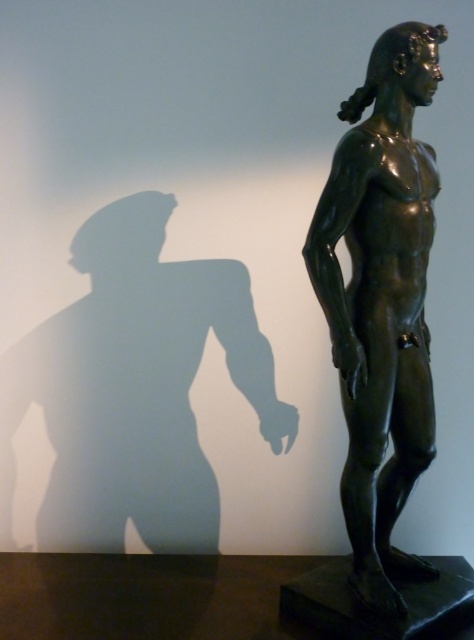
Question: Can you confirm if bronze statue at upper center is bigger than shiny bronze statue at center?

Choices:
 (A) yes
 (B) no

Answer: (B)

Question: Which point is farther to the camera?

Choices:
 (A) (277, 426)
 (B) (371, 124)

Answer: (A)

Question: Can you confirm if bronze statue at upper center is positioned below shiny bronze statue at center?

Choices:
 (A) yes
 (B) no

Answer: (A)

Question: Is bronze statue at upper center closer to camera compared to shiny bronze statue at center?

Choices:
 (A) no
 (B) yes

Answer: (A)

Question: Which object is farther from the camera taking this photo?

Choices:
 (A) bronze statue at upper center
 (B) shiny bronze statue at center

Answer: (A)